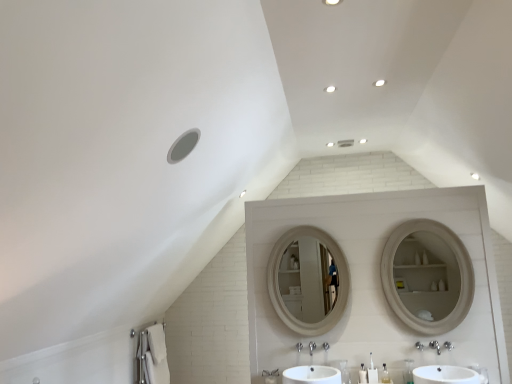
Question: Is white cotton bath towel at lower left not within white plastic toothbrush at lower center, which appears as the first toiletry when viewed from the left?

Choices:
 (A) yes
 (B) no

Answer: (A)

Question: Can you confirm if white cotton bath towel at lower left is wider than white plastic toothbrush at lower center, which appears as the first toiletry when viewed from the left?

Choices:
 (A) yes
 (B) no

Answer: (A)

Question: Does white cotton bath towel at lower left come in front of white plastic toothbrush at lower center, which appears as the first toiletry when viewed from the left?

Choices:
 (A) no
 (B) yes

Answer: (A)

Question: Can you confirm if white cotton bath towel at lower left is positioned to the right of white plastic toothbrush at lower center, which appears as the first toiletry when viewed from the left?

Choices:
 (A) yes
 (B) no

Answer: (B)

Question: Can you confirm if white cotton bath towel at lower left is smaller than white plastic toothbrush at lower center, placed as the fourth toiletry when sorted from right to left?

Choices:
 (A) no
 (B) yes

Answer: (A)

Question: Is white cotton bath towel at lower left bigger than white plastic toothbrush at lower center, which appears as the first toiletry when viewed from the left?

Choices:
 (A) yes
 (B) no

Answer: (A)

Question: Is clear plastic bottle at center, which ranks as the second toiletry in right-to-left order, in contact with white cotton bath towel at lower left?

Choices:
 (A) yes
 (B) no

Answer: (B)

Question: Considering the relative sizes of clear plastic bottle at center, which ranks as the second toiletry in right-to-left order, and white cotton bath towel at lower left in the image provided, is clear plastic bottle at center, which ranks as the second toiletry in right-to-left order, bigger than white cotton bath towel at lower left?

Choices:
 (A) yes
 (B) no

Answer: (B)

Question: Is clear plastic bottle at center, marked as the 3th toiletry in a left-to-right arrangement, to the left of white cotton bath towel at lower left from the viewer's perspective?

Choices:
 (A) yes
 (B) no

Answer: (B)

Question: Is clear plastic bottle at center, which ranks as the second toiletry in right-to-left order, thinner than white cotton bath towel at lower left?

Choices:
 (A) yes
 (B) no

Answer: (A)

Question: Can we say clear plastic bottle at center, marked as the 3th toiletry in a left-to-right arrangement, lies outside white cotton bath towel at lower left?

Choices:
 (A) yes
 (B) no

Answer: (A)

Question: From the image's perspective, does clear plastic bottle at center, marked as the 3th toiletry in a left-to-right arrangement, appear lower than white cotton bath towel at lower left?

Choices:
 (A) yes
 (B) no

Answer: (B)

Question: From a real-world perspective, is white glossy sink at center, which ranks as the 1th sink in left-to-right order, positioned under white plastic toothbrush at lower center, which appears as the first toiletry when viewed from the left, based on gravity?

Choices:
 (A) no
 (B) yes

Answer: (B)